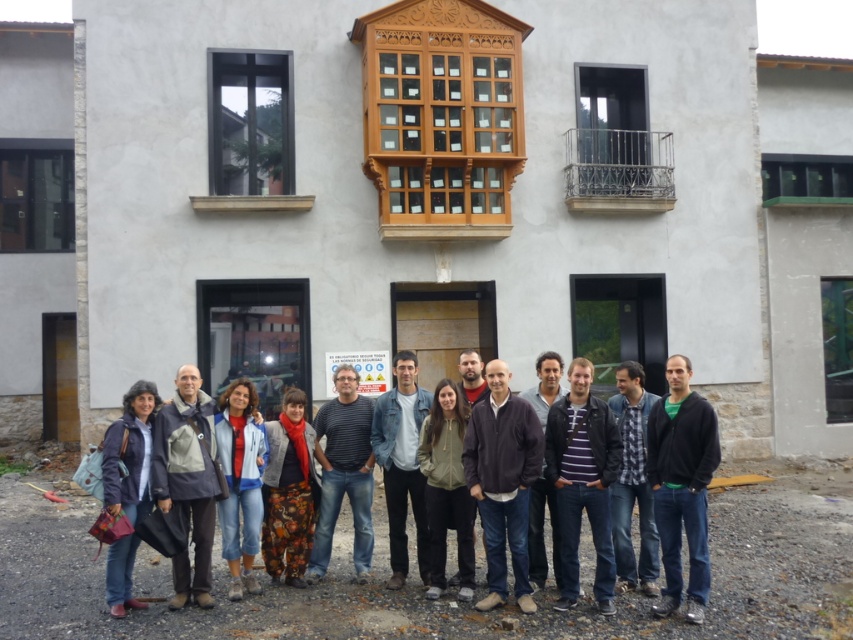
Question: Does purple striped shirt at center lie behind matte blue jacket at lower left?

Choices:
 (A) no
 (B) yes

Answer: (B)

Question: Which object is farther from the camera taking this photo?

Choices:
 (A) dark brown leather jacket at center
 (B) dark brown sweater at center

Answer: (A)

Question: Can you confirm if green matte jacket at center is wider than blue denim jeans at center?

Choices:
 (A) yes
 (B) no

Answer: (A)

Question: Is black matte jacket at center to the right of striped cotton shirt at center from the viewer's perspective?

Choices:
 (A) yes
 (B) no

Answer: (A)

Question: Among these objects, which one is farthest from the camera?

Choices:
 (A) green matte jacket at center
 (B) matte blue jacket at lower left
 (C) denim jacket at center
 (D) black matte jacket at center

Answer: (C)

Question: Which point appears farthest from the camera in this image?

Choices:
 (A) (132, 396)
 (B) (578, 451)
 (C) (506, 380)

Answer: (A)